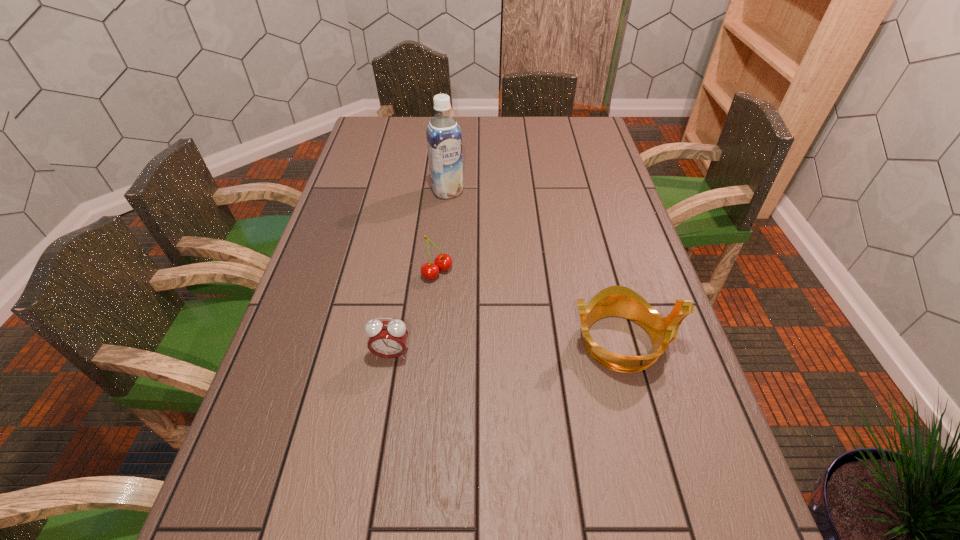
Image resolution: width=960 pixels, height=540 pixels. Find the location of `unoccupied position between the farthest object and the tiara`. unoccupied position between the farthest object and the tiara is located at coordinates (535, 266).

Where is `free space between the alarm clock and the farthest object`? free space between the alarm clock and the farthest object is located at coordinates (420, 273).

Locate an element on the screen. This screenshot has height=540, width=960. free space that is in between the rightmost object and the alarm clock is located at coordinates (507, 348).

I want to click on free area in between the tiara and the soya milk, so click(x=535, y=266).

The height and width of the screenshot is (540, 960). What are the coordinates of `free spot between the tiara and the soya milk` in the screenshot? It's located at (535, 266).

I want to click on empty space between the alarm clock and the rightmost object, so click(x=507, y=348).

In order to click on empty location between the cherry and the farthest object in this screenshot , I will do `click(443, 232)`.

Find the location of `free space between the alarm clock and the third nearest object`. free space between the alarm clock and the third nearest object is located at coordinates (414, 313).

The width and height of the screenshot is (960, 540). In order to click on object that is the third nearest to the cherry in this screenshot , I will do `click(620, 301)`.

Select which object appears as the second closest to the tallest object. Please provide its 2D coordinates. Your answer should be formatted as a tuple, i.e. [(x, y)], where the tuple contains the x and y coordinates of a point satisfying the conditions above.

[(620, 301)]